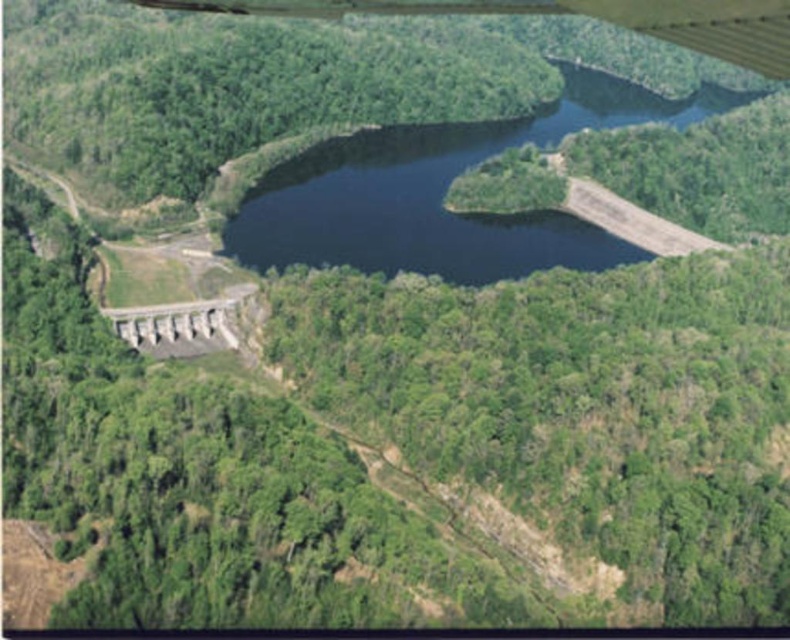
Question: Which point is closer to the camera?

Choices:
 (A) tap(565, 76)
 (B) tap(329, 1)

Answer: (B)

Question: Does dark blue water at center appear under metallic gray wing at upper center?

Choices:
 (A) no
 (B) yes

Answer: (A)

Question: Which point is farther from the camera taking this photo?

Choices:
 (A) (422, 211)
 (B) (781, 40)

Answer: (A)

Question: Is dark blue water at center positioned at the back of metallic gray wing at upper center?

Choices:
 (A) yes
 (B) no

Answer: (A)

Question: Which point is closer to the camera taking this photo?

Choices:
 (A) (269, 4)
 (B) (566, 104)

Answer: (A)

Question: Is dark blue water at center above metallic gray wing at upper center?

Choices:
 (A) yes
 (B) no

Answer: (A)